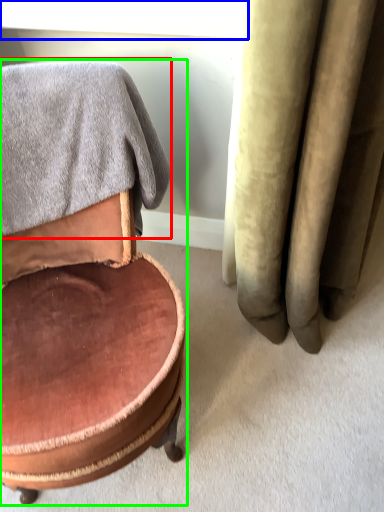
Question: Which object is the farthest from bath towel (highlighted by a red box)? Choose among these: window screen (highlighted by a blue box) or chair (highlighted by a green box).

Choices:
 (A) window screen
 (B) chair

Answer: (A)